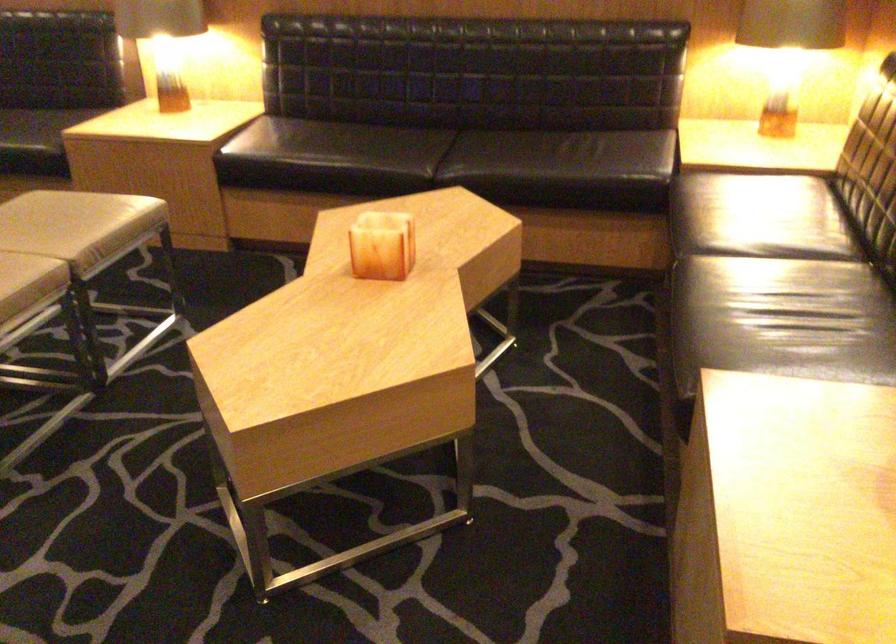
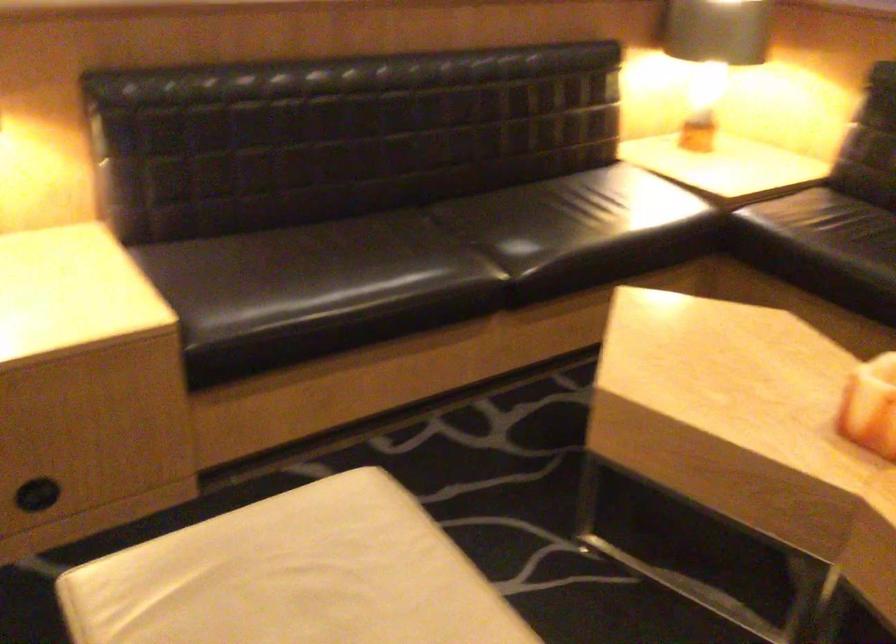
Question: I am providing you with two images of the same scene from different viewpoints. After the viewpoint changes to image2, which objects are now occluded?

Choices:
 (A) white chair sitting surface
 (B) black game controller
 (C) beige chair sitting surface
 (D) black sofa sitting surface

Answer: (C)